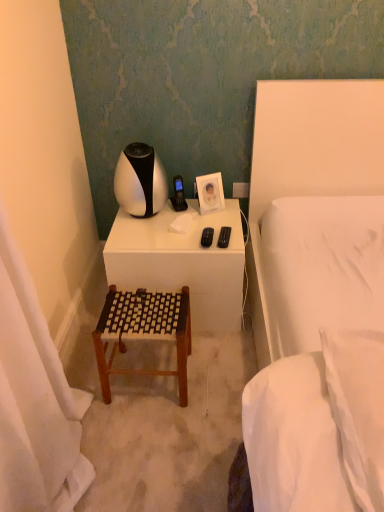
Where is `free space in front of brown woven stool at center`? free space in front of brown woven stool at center is located at coordinates (147, 438).